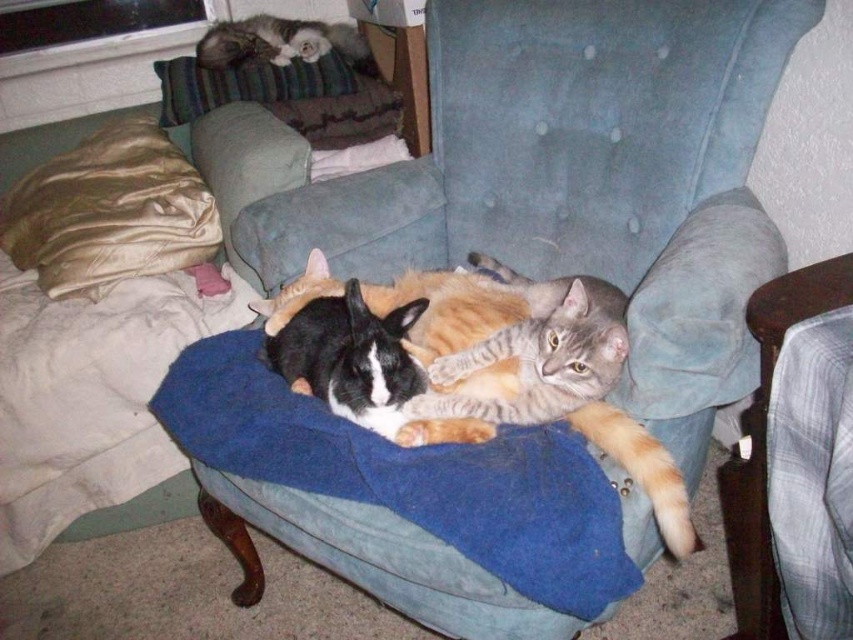
You are trying to place a new throw blanket on the blue fabric chair at lower right. Considering the size of the fluffy gray cat at upper left, will the blanket fit properly on the chair?

The blue fabric chair at lower right has a lesser width compared to the fluffy gray cat at upper left, so the blanket may not fit properly as the chair is narrower than the cat.

Based on the photo, you are a cat owner who wants to cover both cats with a blanket. Given that the blue fleece blanket at center is to the left of the blue fabric chair at lower right, which object should you move to reach the cats first?

You should move the blue fleece blanket at center first because it is closer to the cats than the blue fabric chair at lower right, which is further to the right.